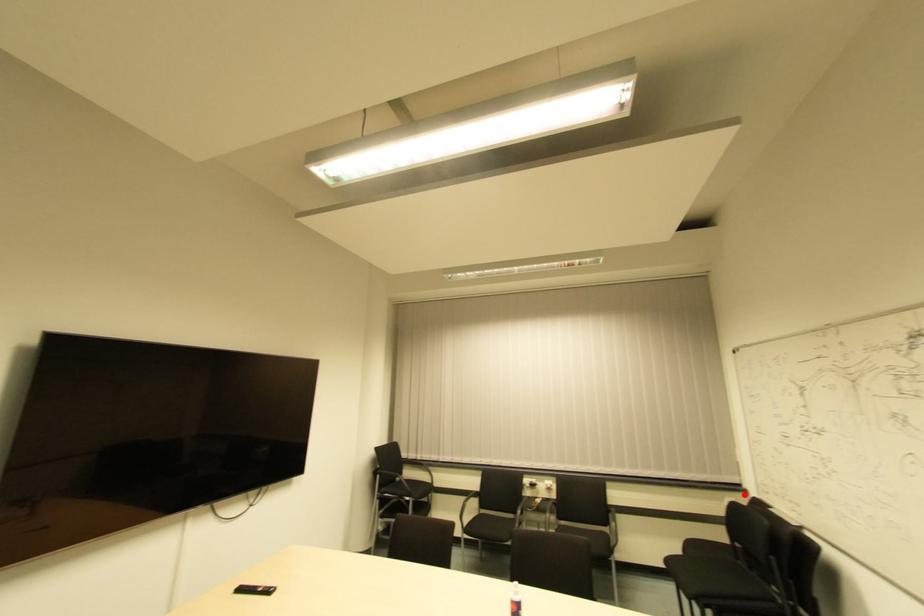
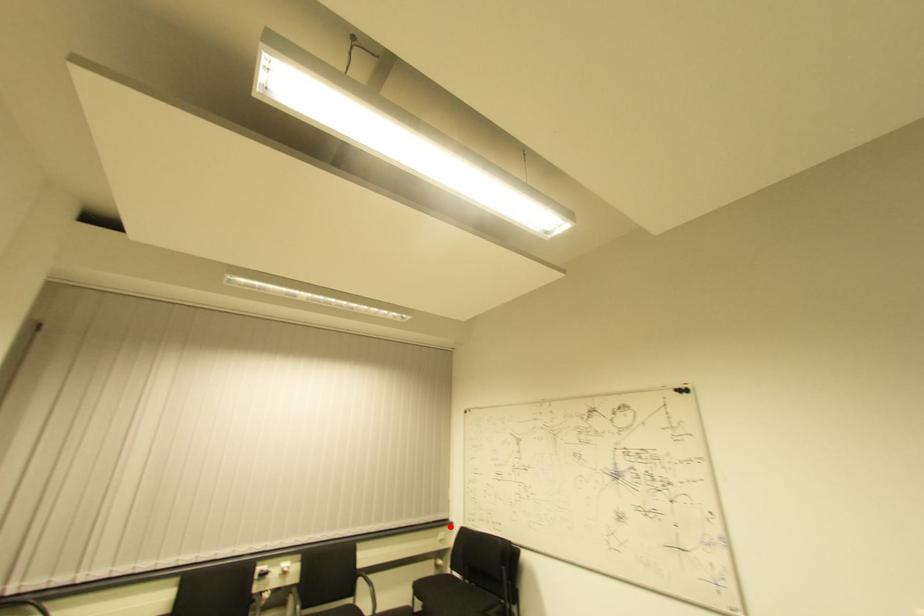
I am providing you with two images of the same scene from different viewpoints. A red point is marked on the first image and another point is marked on the second image. Is the red point in image1 aligned with the point shown in image2?

Yes